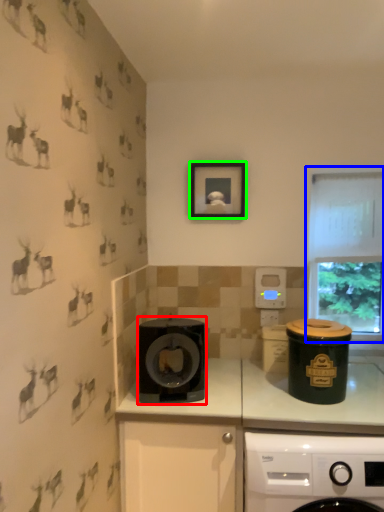
Question: Which is nearer to the kitchen appliance (highlighted by a red box)? window (highlighted by a blue box) or picture frame (highlighted by a green box).

Choices:
 (A) window
 (B) picture frame

Answer: (B)